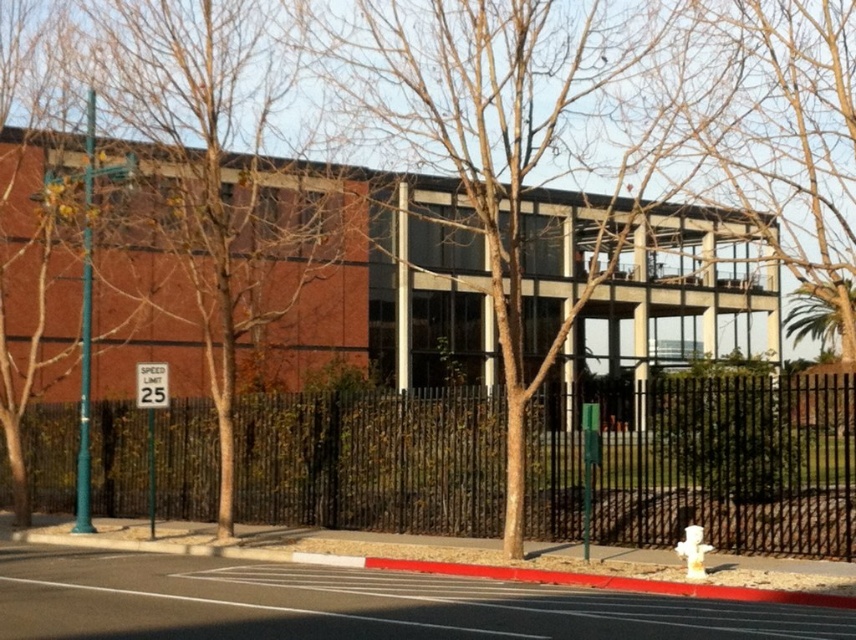
Question: Estimate the real-world distances between objects in this image. Which object is closer to the black metal fence at center?

Choices:
 (A) white plastic hydrant at lower right
 (B) bare wood tree at center

Answer: (A)

Question: Does black metal fence at center have a smaller size compared to bare wood tree at center?

Choices:
 (A) no
 (B) yes

Answer: (B)

Question: Does black metal fence at center have a greater width compared to bare wood tree at center?

Choices:
 (A) no
 (B) yes

Answer: (B)

Question: Among these objects, which one is nearest to the camera?

Choices:
 (A) white plastic hydrant at lower right
 (B) black metal fence at center

Answer: (A)

Question: Which point appears farthest from the camera in this image?

Choices:
 (A) (730, 92)
 (B) (474, 476)

Answer: (A)

Question: Is black metal fence at center to the left of bare wood tree at center from the viewer's perspective?

Choices:
 (A) yes
 (B) no

Answer: (A)